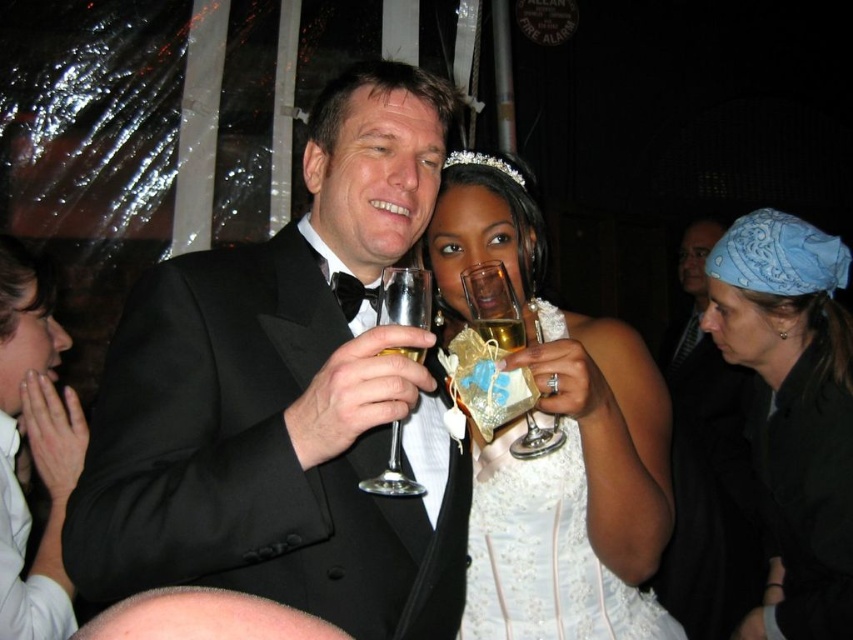
Consider the image. Between white lace dress at center and dark gray suit at right, which one has more height?

Standing taller between the two is dark gray suit at right.

Which is above, white lace dress at center or dark gray suit at right?

dark gray suit at right is above.

The height and width of the screenshot is (640, 853). What do you see at coordinates (544, 554) in the screenshot?
I see `white lace dress at center` at bounding box center [544, 554].

Where is `white lace dress at center`? white lace dress at center is located at coordinates (544, 554).

Who is taller, black satin tuxedo at center or dark gray suit at right?

With more height is dark gray suit at right.

Who is more distant from viewer, (329,163) or (685,600)?

The point (685,600) is behind.

Which is behind, point (263, 499) or point (720, 234)?

Point (720, 234)

You are a GUI agent. You are given a task and a screenshot of the screen. Output one action in this format:
    pyautogui.click(x=<x>, y=<y>)
    Task: Click on the black satin tuxedo at center
    
    Given the screenshot: What is the action you would take?
    pyautogui.click(x=287, y=397)

Between point (795, 637) and point (399, 428), which one is positioned behind?

The point (795, 637) is more distant.

Does blue bandana at upper right come in front of clear glass wine glass at center?

No, it is behind clear glass wine glass at center.

What do you see at coordinates (793, 408) in the screenshot? This screenshot has width=853, height=640. I see `blue bandana at upper right` at bounding box center [793, 408].

Where is `blue bandana at upper right`? blue bandana at upper right is located at coordinates (793, 408).